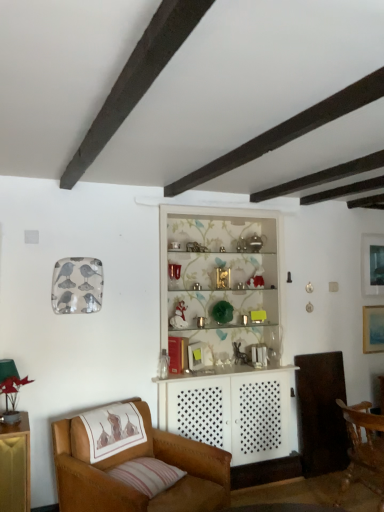
Question: Based on their sizes in the image, would you say striped fabric pillow at lower left is bigger or smaller than wooden chair at lower right, which is the 1th chair from right to left?

Choices:
 (A) big
 (B) small

Answer: (B)

Question: Is striped fabric pillow at lower left taller or shorter than wooden chair at lower right, which is the 1th chair from right to left?

Choices:
 (A) short
 (B) tall

Answer: (A)

Question: Considering the real-world distances, which object is closest to the matte black picture frame at upper right, which is the 2th picture frame in bottom-to-top order?

Choices:
 (A) leather armchair at lower left, the 1th chair viewed from the left
 (B) striped fabric pillow at lower left
 (C) matte blue painting at upper right, the 2th picture frame when ordered from top to bottom
 (D) wooden chair at lower right, which is the 1th chair from right to left

Answer: (C)

Question: Which of these objects is positioned farthest from the striped fabric pillow at lower left?

Choices:
 (A) matte blue painting at upper right, the 2th picture frame when ordered from top to bottom
 (B) matte black picture frame at upper right, which is the 2th picture frame in bottom-to-top order
 (C) leather armchair at lower left, the second chair viewed from the right
 (D) wooden chair at lower right, which appears as the 2th chair when viewed from the left

Answer: (B)